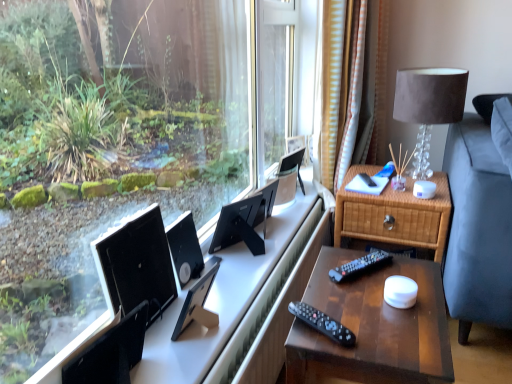
Find the location of a particular element. free spot to the right of black plastic remote control at lower center, which is the second remote control from top to bottom is located at coordinates (381, 326).